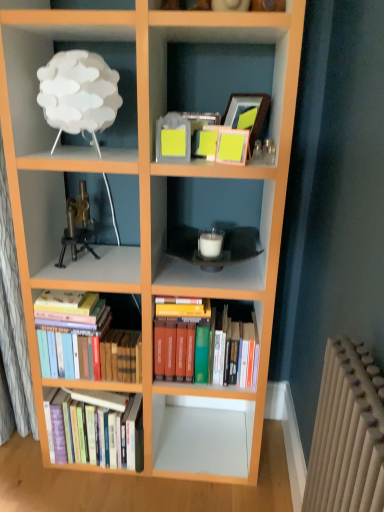
Image resolution: width=384 pixels, height=512 pixels. In order to click on free spot in front of hardcover books at lower left, the first book positioned from the left in this screenshot , I will do `click(82, 490)`.